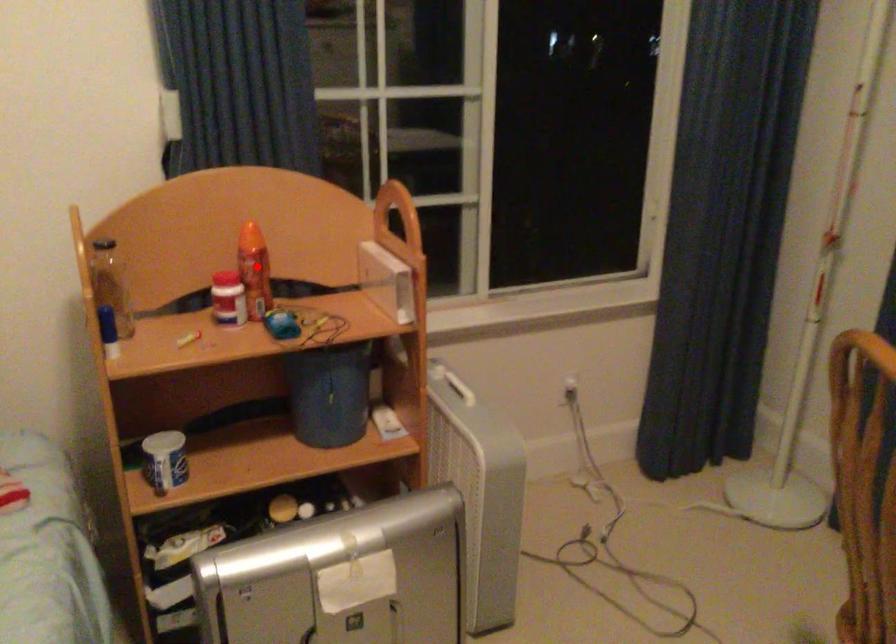
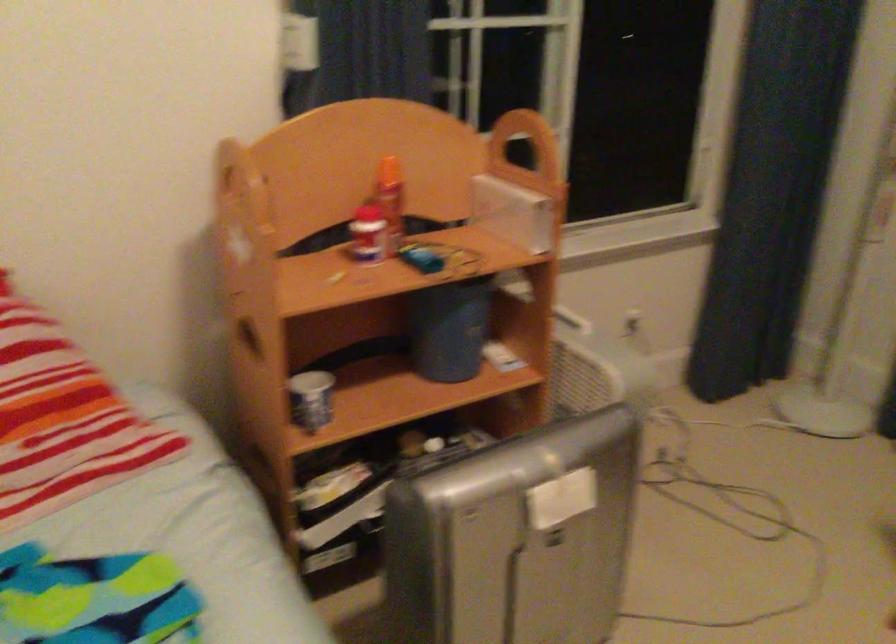
In the second image, find the point that corresponds to the highlighted location in the first image.

(391, 200)